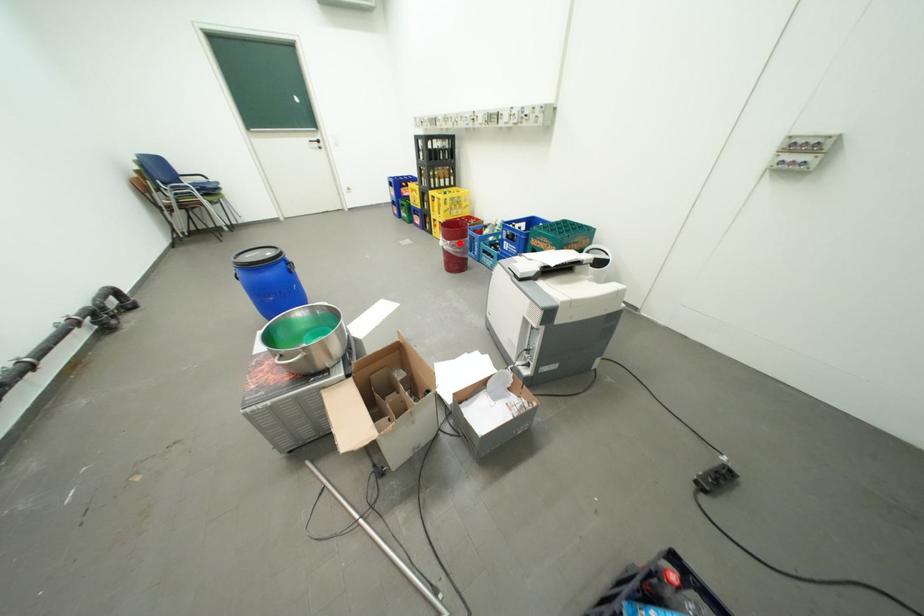
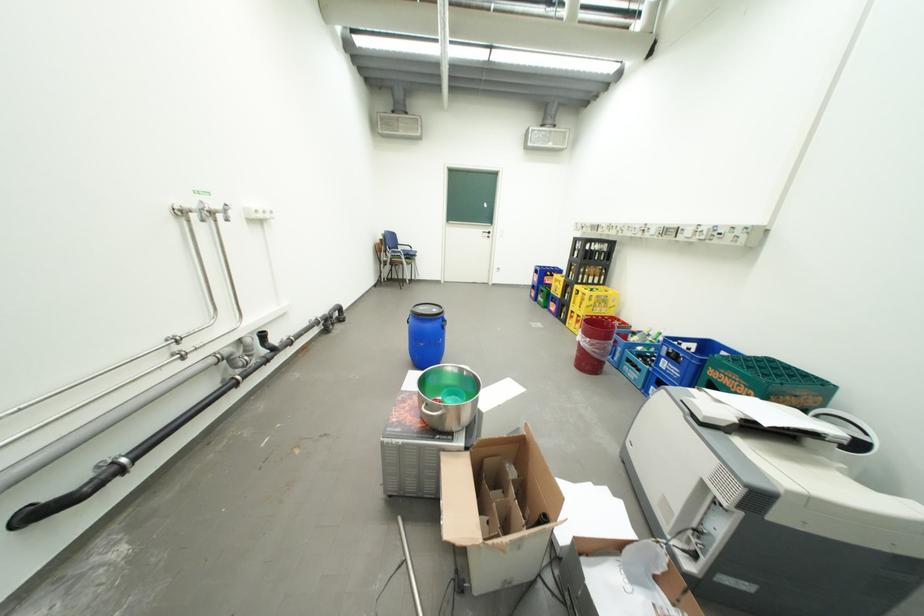
Where in the second image is the point corresponding to the highlighted location from the first image?

(599, 341)